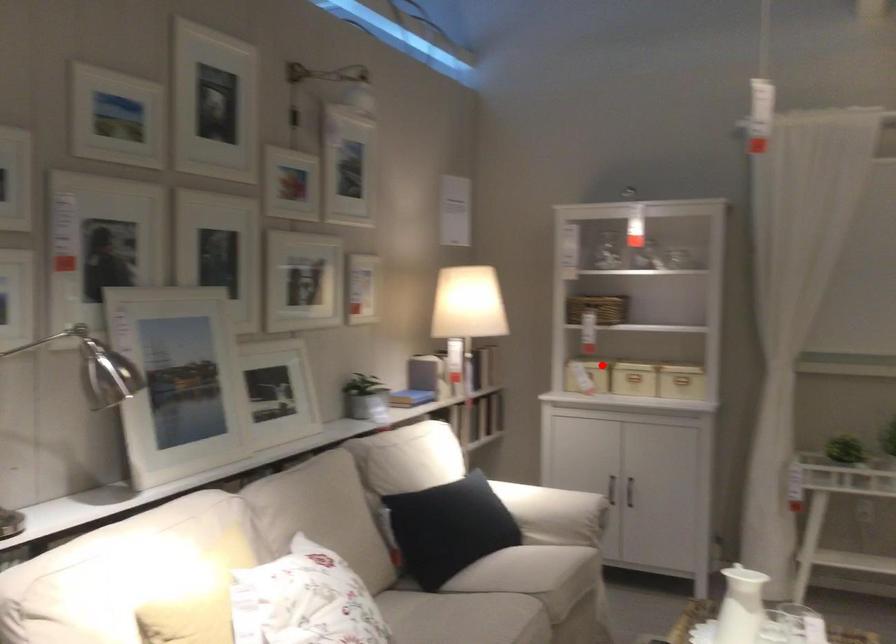
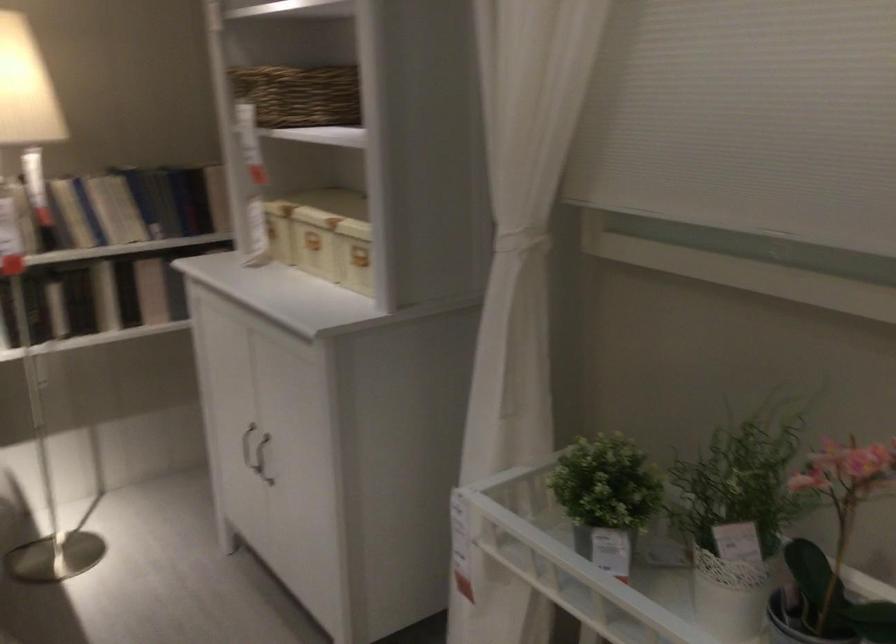
In the second image, find the point that corresponds to the highlighted location in the first image.

(270, 230)